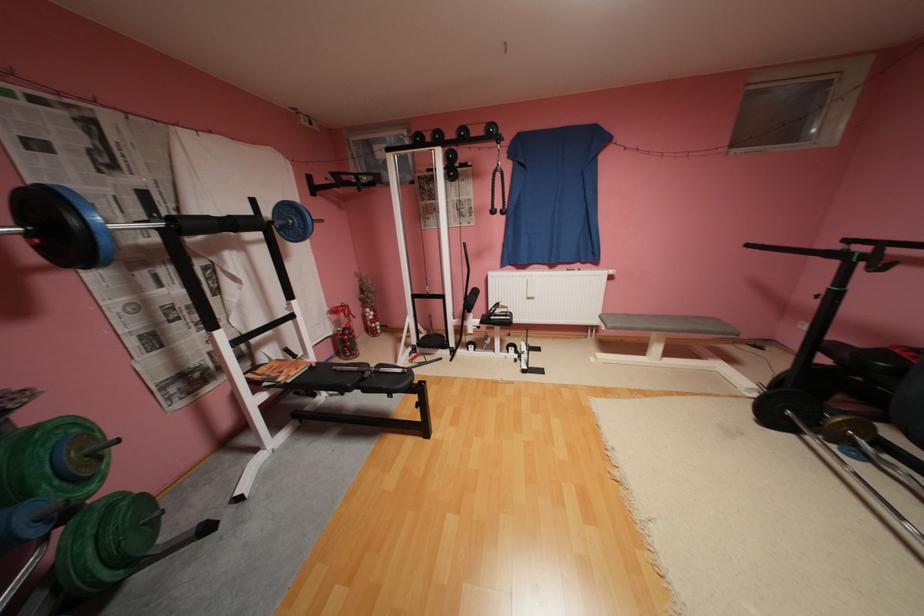
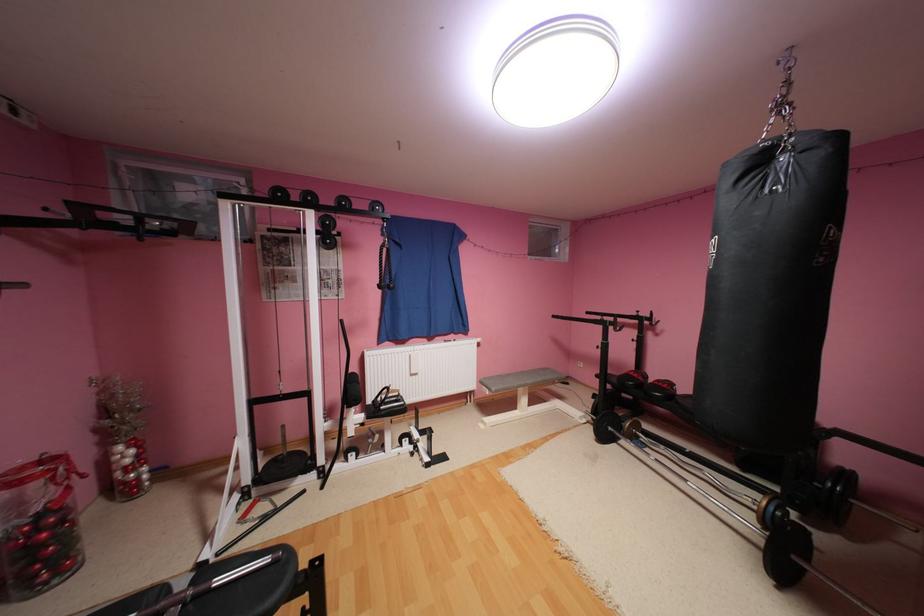
Where in the second image is the point corresponding to [460,344] from the first image?

(331, 460)